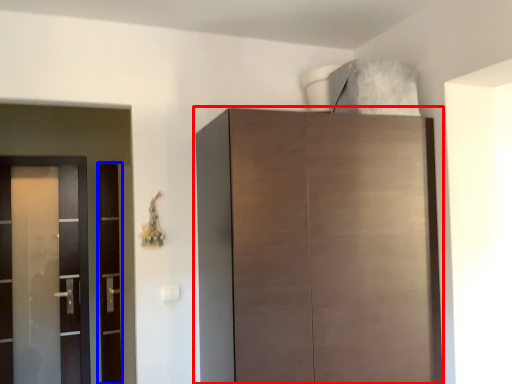
Question: Which object appears farthest to the camera in this image, cupboard (highlighted by a red box) or screen door (highlighted by a blue box)?

Choices:
 (A) cupboard
 (B) screen door

Answer: (B)